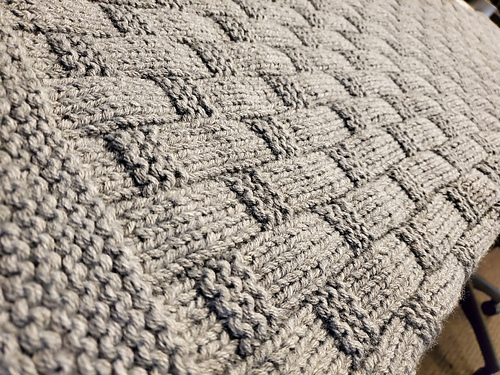
This screenshot has width=500, height=375. What are the coordinates of `rug` in the screenshot? It's located at (452, 351).